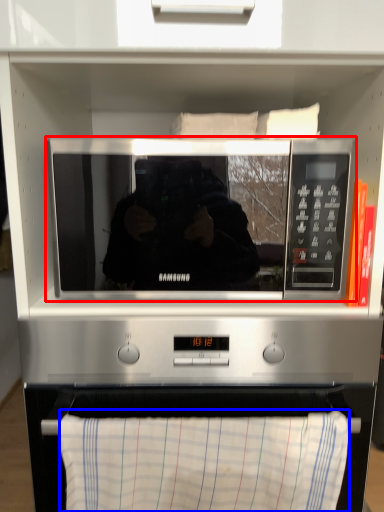
Question: Which point is closer to the camera, microwave oven (highlighted by a red box) or cloth (highlighted by a blue box)?

Choices:
 (A) microwave oven
 (B) cloth

Answer: (B)